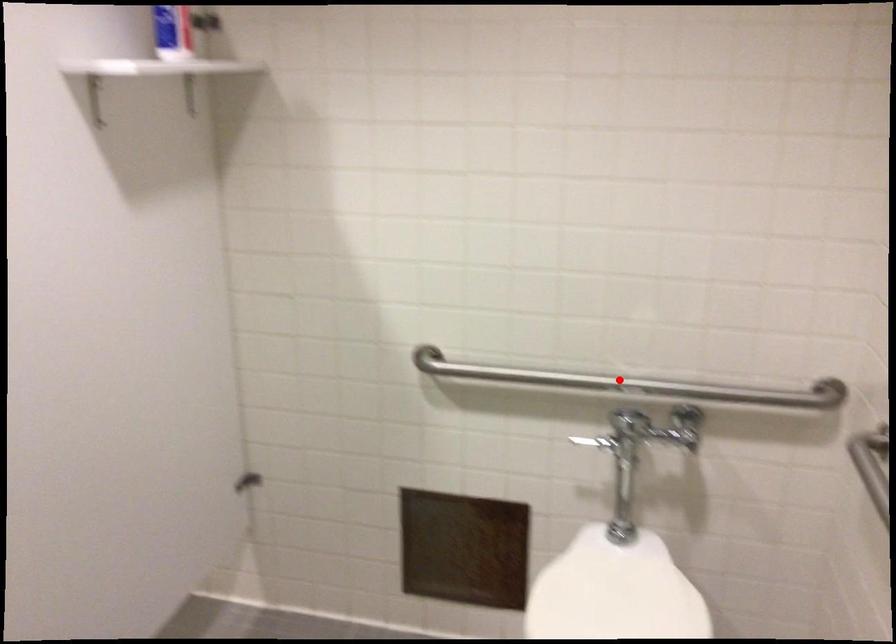
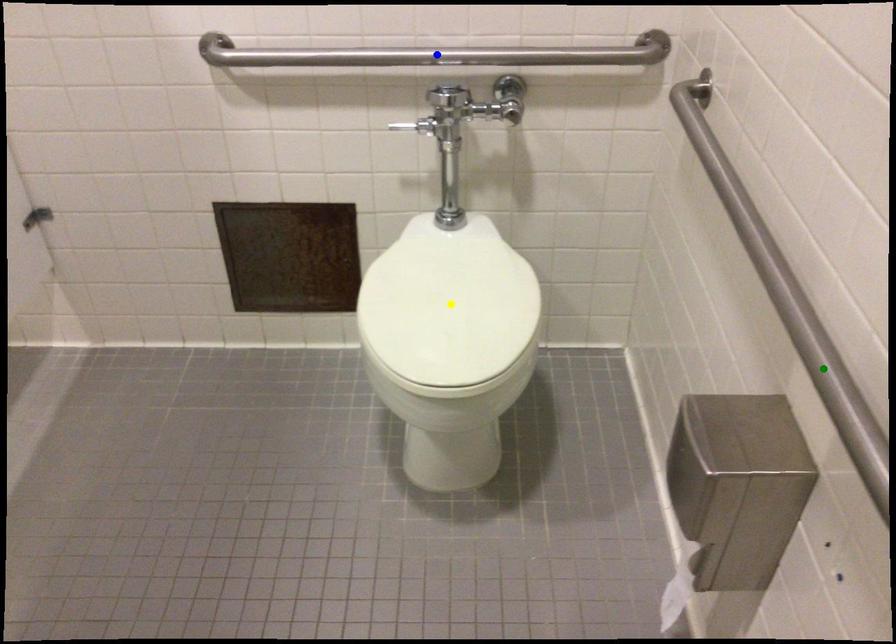
Question: I am providing you with two images of the same scene from different viewpoints. A red point is marked on the first image. You are given multiple points on the second image. Which point in image 2 is actually the same real-world point as the red point in image 1?

Choices:
 (A) blue point
 (B) yellow point
 (C) green point

Answer: (A)